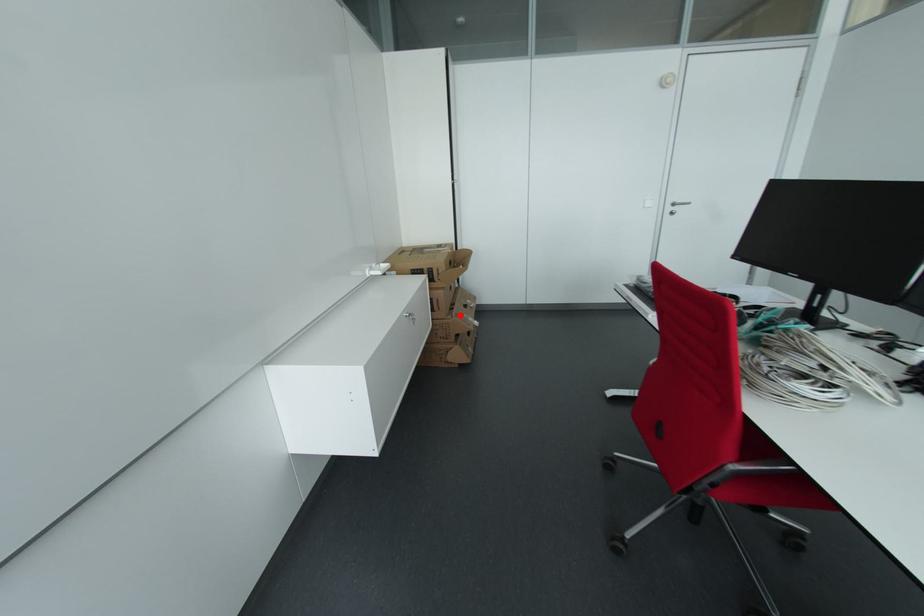
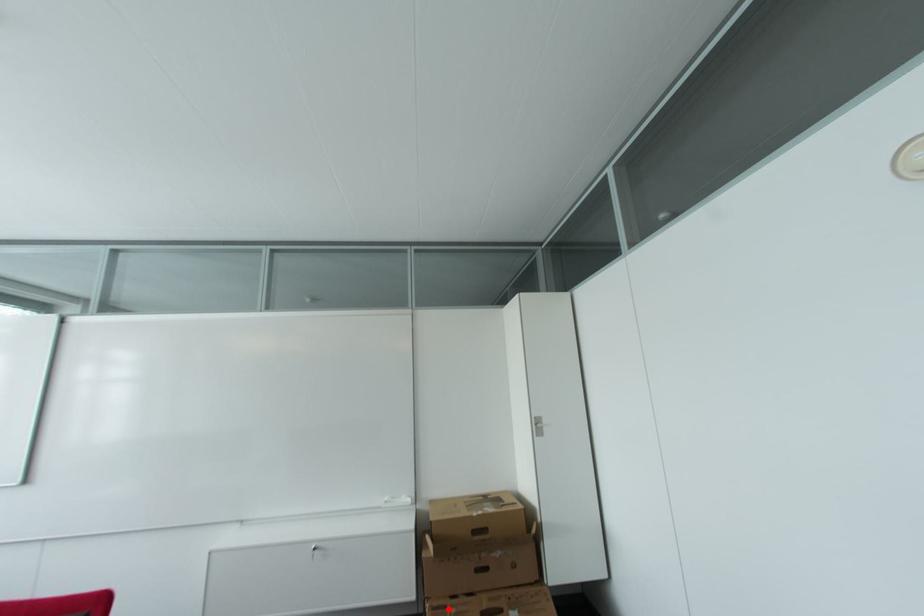
I am providing you with two images of the same scene from different viewpoints. A red point is marked on the first image and another point is marked on the second image. Are the points marked in image1 and image2 representing the same 3D position?

Yes